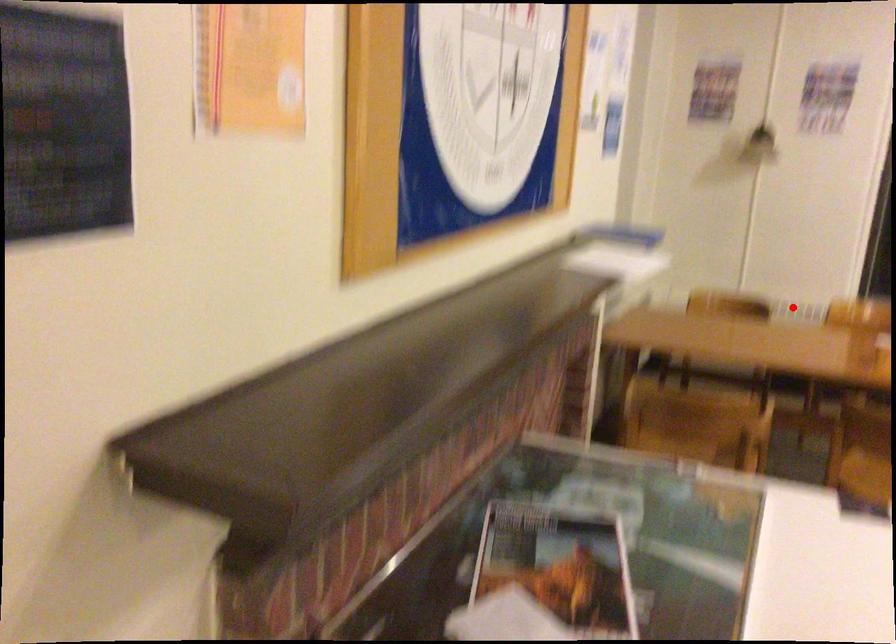
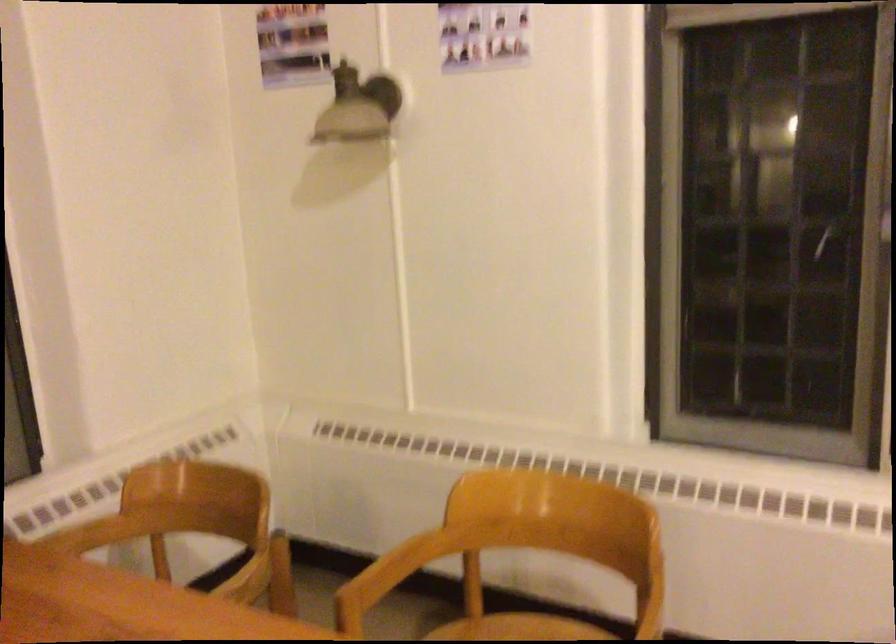
Question: I am providing you with two images of the same scene from different viewpoints. A red point is shown in image1. For the corresponding object point in image2, is it positioned nearer or farther from the camera?

Choices:
 (A) Nearer
 (B) Farther

Answer: (A)